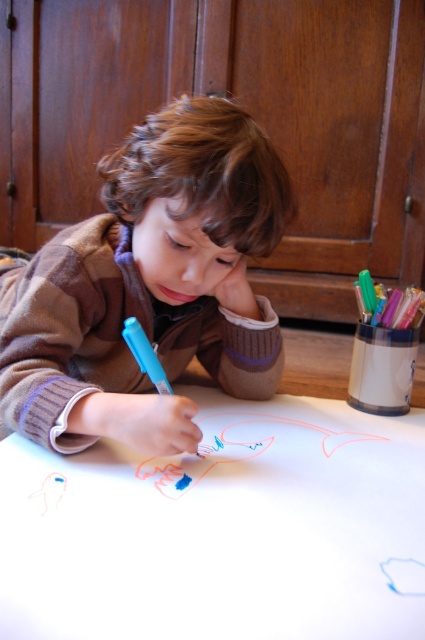
Can you confirm if white paper at center is shorter than matte brown sweater at center?

Correct, white paper at center is not as tall as matte brown sweater at center.

Can you confirm if white paper at center is wider than matte brown sweater at center?

Yes, white paper at center is wider than matte brown sweater at center.

Image resolution: width=425 pixels, height=640 pixels. What are the coordinates of `white paper at center` in the screenshot? It's located at (221, 529).

You are a GUI agent. You are given a task and a screenshot of the screen. Output one action in this format:
    pyautogui.click(x=<x>, y=<y>)
    Task: Click on the white paper at center
    The image size is (425, 640).
    Given the screenshot: What is the action you would take?
    pyautogui.click(x=221, y=529)